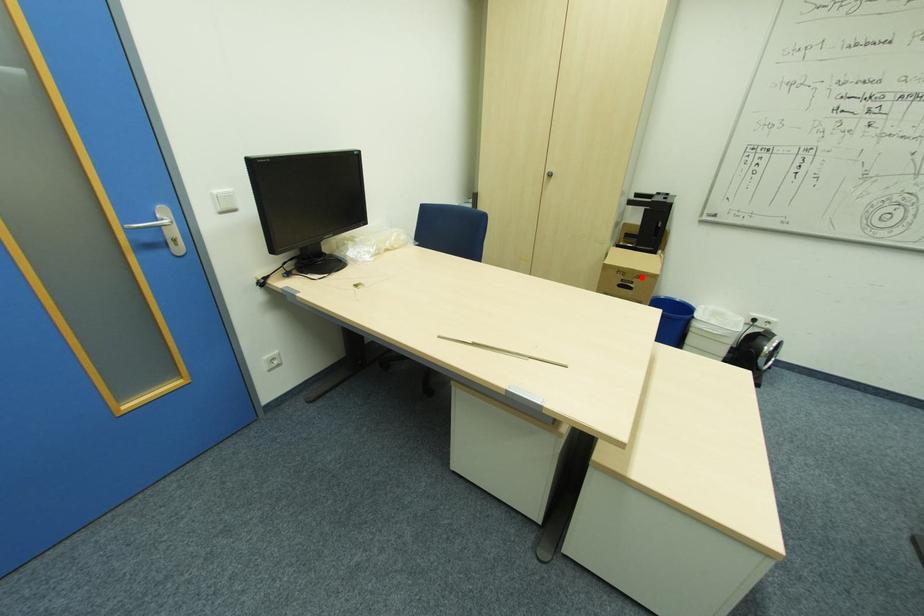
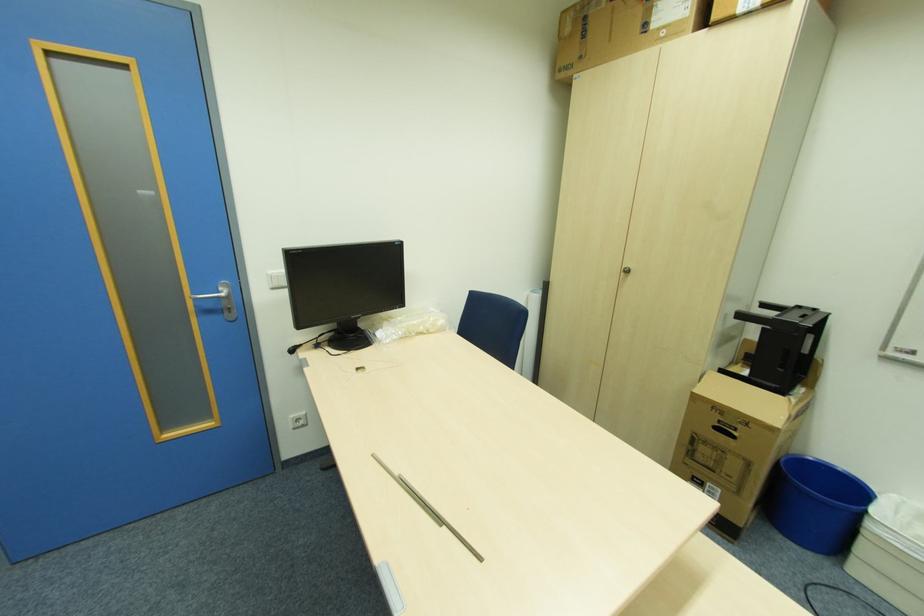
In the second image, find the point that corresponds to the highlighted location in the first image.

(748, 424)